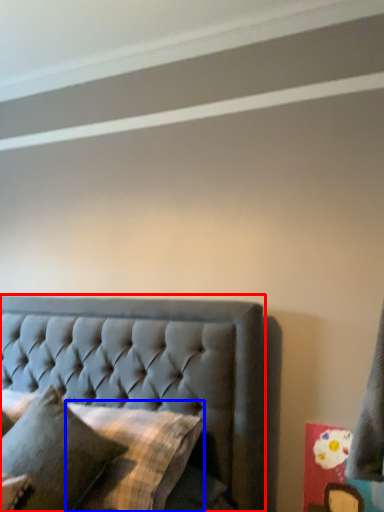
Question: Which object appears closest to the camera in this image, bed (highlighted by a red box) or pillow (highlighted by a blue box)?

Choices:
 (A) bed
 (B) pillow

Answer: (A)